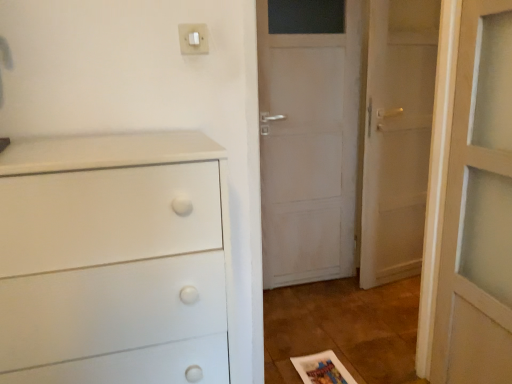
Question: Does white plastic light switch at upper center appear on the left side of white matte chest of drawers at left?

Choices:
 (A) yes
 (B) no

Answer: (B)

Question: Does white plastic light switch at upper center have a smaller size compared to white matte chest of drawers at left?

Choices:
 (A) no
 (B) yes

Answer: (B)

Question: Can you confirm if white plastic light switch at upper center is bigger than white matte chest of drawers at left?

Choices:
 (A) yes
 (B) no

Answer: (B)

Question: From a real-world perspective, is white plastic light switch at upper center physically below white matte chest of drawers at left?

Choices:
 (A) no
 (B) yes

Answer: (A)

Question: Is white plastic light switch at upper center taller than white matte chest of drawers at left?

Choices:
 (A) yes
 (B) no

Answer: (B)

Question: Considering the positions of white wooden door at right and white matte chest of drawers at left in the image, is white wooden door at right wider or thinner than white matte chest of drawers at left?

Choices:
 (A) wide
 (B) thin

Answer: (B)

Question: Considering the relative positions of white wooden door at right and white matte chest of drawers at left in the image provided, is white wooden door at right to the left or to the right of white matte chest of drawers at left?

Choices:
 (A) left
 (B) right

Answer: (B)

Question: Is point (415, 99) closer or farther from the camera than point (55, 244)?

Choices:
 (A) closer
 (B) farther

Answer: (B)

Question: Considering their positions, is white wooden door at right located in front of or behind white matte chest of drawers at left?

Choices:
 (A) behind
 (B) front

Answer: (A)

Question: Considering the relative positions of white wooden door at right and white plastic light switch at upper center in the image provided, is white wooden door at right to the left or to the right of white plastic light switch at upper center?

Choices:
 (A) right
 (B) left

Answer: (A)

Question: From their relative heights in the image, would you say white wooden door at right is taller or shorter than white plastic light switch at upper center?

Choices:
 (A) short
 (B) tall

Answer: (B)

Question: Is white wooden door at right spatially inside white plastic light switch at upper center, or outside of it?

Choices:
 (A) outside
 (B) inside

Answer: (A)

Question: Looking at their shapes, would you say white wooden door at right is wider or thinner than white plastic light switch at upper center?

Choices:
 (A) wide
 (B) thin

Answer: (A)

Question: Is white matte chest of drawers at left wider or thinner than white plastic light switch at upper center?

Choices:
 (A) thin
 (B) wide

Answer: (B)

Question: From the image's perspective, is white matte chest of drawers at left located above or below white plastic light switch at upper center?

Choices:
 (A) above
 (B) below

Answer: (B)